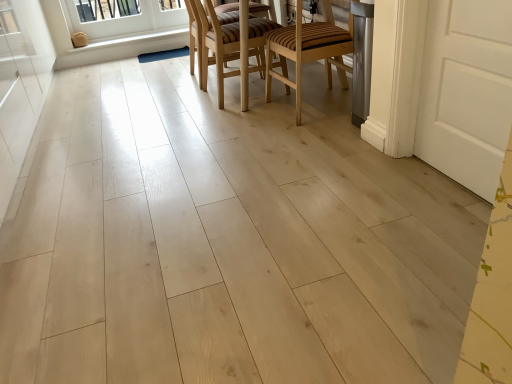
Find the location of `free spot above white painted wood at upper left (from a real-world perspective)`. free spot above white painted wood at upper left (from a real-world perspective) is located at coordinates (115, 40).